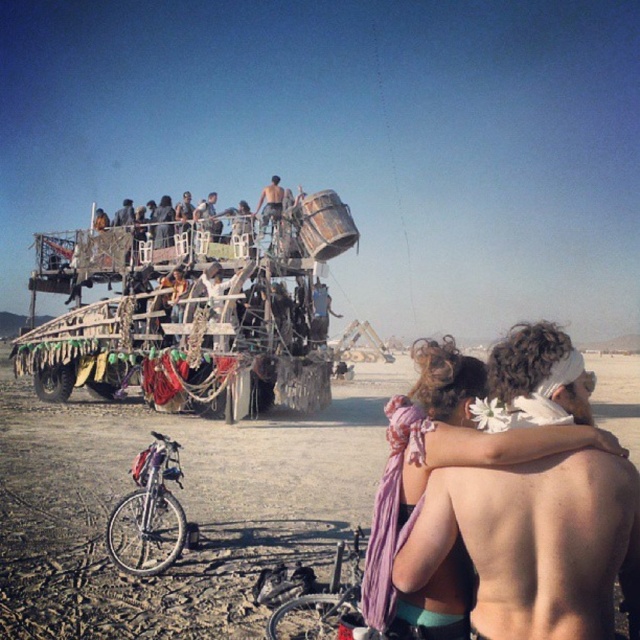
You are standing at the festival and want to take a photo of the point at coordinates (605, 364). If your camera has a maximum zoom range of 100 meters, will you be able to capture the point clearly?

The point at coordinates (605, 364) is 134.01 meters away from the viewer. Since the camera can only zoom up to 100 meters, it will not be able to capture the point clearly.